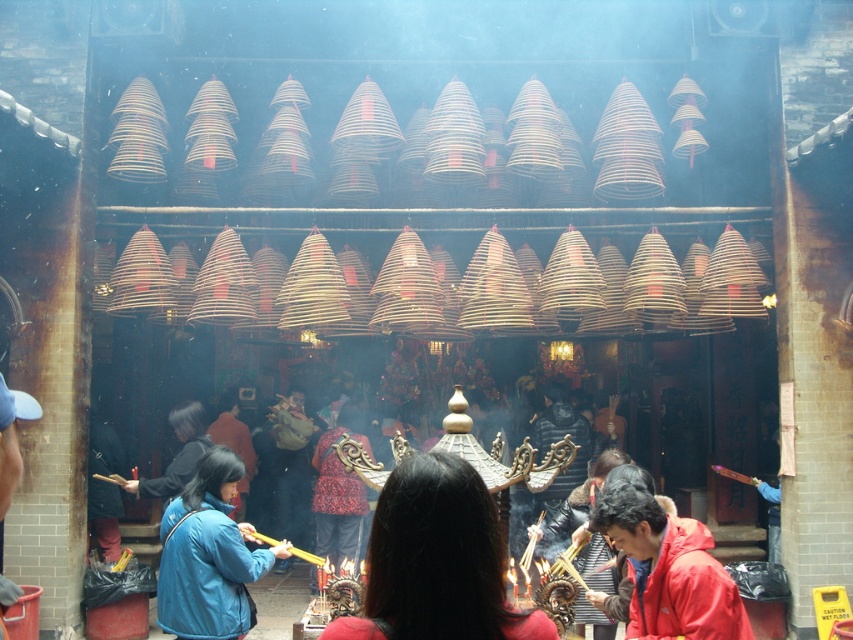
You are standing at the entrance of the temple and see the red matte jacket at lower right. There is a door 2 meters wide that you need to pass through to reach it. Can you walk through the door without touching the jacket?

The red matte jacket at lower right is 7.33 meters away from you. Since the door is 2 meters wide, you can walk through the door without touching the jacket as the distance is sufficient.

You are a visitor to the temple and want to determine which fabric is more suitable for covering a small ceremonial object. Based on the sizes of the blue fabric robe at lower left and the red patterned fabric at center, which one would you choose?

The blue fabric robe at lower left has a smaller size compared to the red patterned fabric at center, so it would be more suitable for covering a small ceremonial object.

You are standing in the temple and want to take a photo of both point (473,524) and point (648,605). Which point should you focus on first to ensure both are in focus?

You should focus on point (473,524) first because it is closer to the camera than point (648,605). By focusing on the closer point, the depth of field may include the farther point as well, ensuring both are in focus.